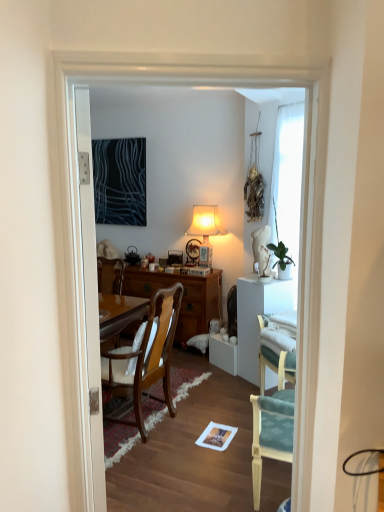
Question: Is white glossy door at left facing towards dark blue fabric at upper left?

Choices:
 (A) yes
 (B) no

Answer: (B)

Question: Is white glossy door at left further to the viewer compared to dark blue fabric at upper left?

Choices:
 (A) yes
 (B) no

Answer: (B)

Question: From a real-world perspective, is white glossy door at left located higher than dark blue fabric at upper left?

Choices:
 (A) yes
 (B) no

Answer: (B)

Question: Is white glossy door at left turned away from dark blue fabric at upper left?

Choices:
 (A) yes
 (B) no

Answer: (B)

Question: Can you confirm if white glossy door at left is positioned to the right of dark blue fabric at upper left?

Choices:
 (A) yes
 (B) no

Answer: (A)

Question: Considering the positions of white glossy door at left and dark blue fabric at upper left in the image, is white glossy door at left wider or thinner than dark blue fabric at upper left?

Choices:
 (A) wide
 (B) thin

Answer: (A)

Question: From the image's perspective, is white glossy door at left positioned above or below dark blue fabric at upper left?

Choices:
 (A) above
 (B) below

Answer: (B)

Question: Looking at the image, does white glossy door at left seem bigger or smaller compared to dark blue fabric at upper left?

Choices:
 (A) big
 (B) small

Answer: (A)

Question: From a real-world perspective, is white glossy door at left physically located above or below dark blue fabric at upper left?

Choices:
 (A) above
 (B) below

Answer: (B)

Question: Does point (96, 483) appear closer or farther from the camera than point (263, 381)?

Choices:
 (A) closer
 (B) farther

Answer: (A)

Question: Visually, is white glossy door at left positioned to the left or to the right of teal fabric chair at right, placed as the 1th chair when sorted from front to back?

Choices:
 (A) right
 (B) left

Answer: (B)

Question: Do you think white glossy door at left is within teal fabric chair at right, placed as the 2th chair when sorted from left to right, or outside of it?

Choices:
 (A) outside
 (B) inside

Answer: (A)

Question: From a real-world perspective, is white glossy door at left physically located above or below teal fabric chair at right, placed as the 1th chair when sorted from front to back?

Choices:
 (A) above
 (B) below

Answer: (A)

Question: Which is correct: green glossy houseplant at upper right is inside wooden chair with cushion at center, the second chair viewed from the right, or outside of it?

Choices:
 (A) inside
 (B) outside

Answer: (B)

Question: Is green glossy houseplant at upper right wider or thinner than wooden chair with cushion at center, the first chair when ordered from back to front?

Choices:
 (A) wide
 (B) thin

Answer: (B)